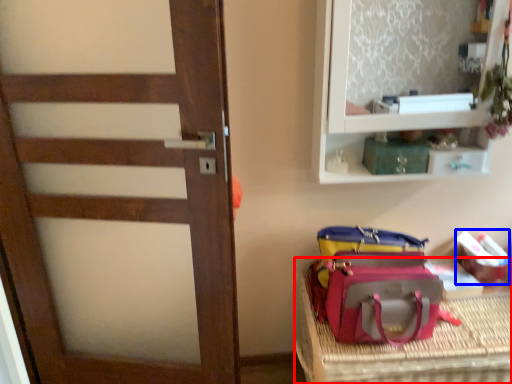
Question: Which object appears farthest to the camera in this image, furniture (highlighted by a red box) or kit (highlighted by a blue box)?

Choices:
 (A) furniture
 (B) kit

Answer: (B)